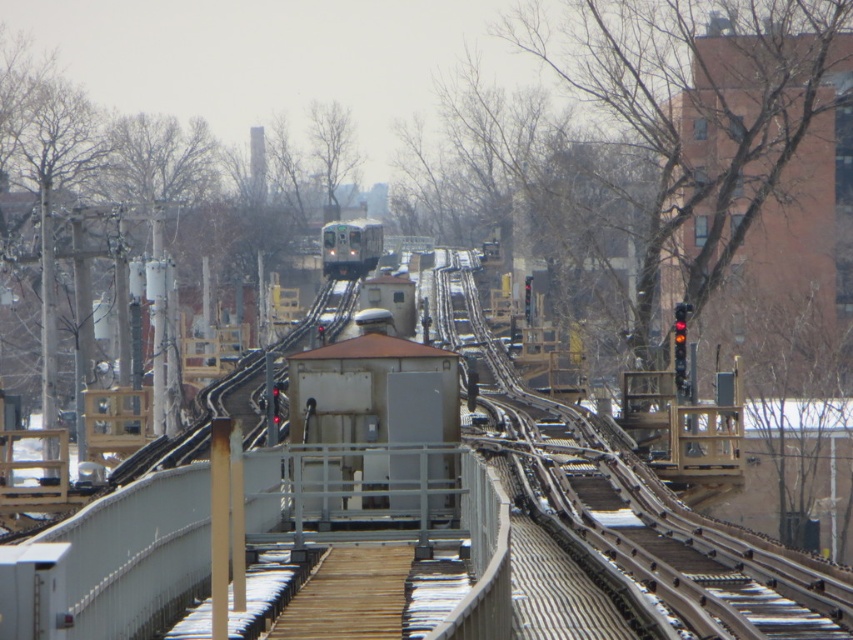
Between metal train track at center and green metallic train at center, which one appears on the right side from the viewer's perspective?

Positioned to the right is metal train track at center.

Does metal train track at center appear under green metallic train at center?

Yes, metal train track at center is below green metallic train at center.

You are a GUI agent. You are given a task and a screenshot of the screen. Output one action in this format:
    pyautogui.click(x=<x>, y=<y>)
    Task: Click on the metal train track at center
    
    Given the screenshot: What is the action you would take?
    pyautogui.click(x=635, y=500)